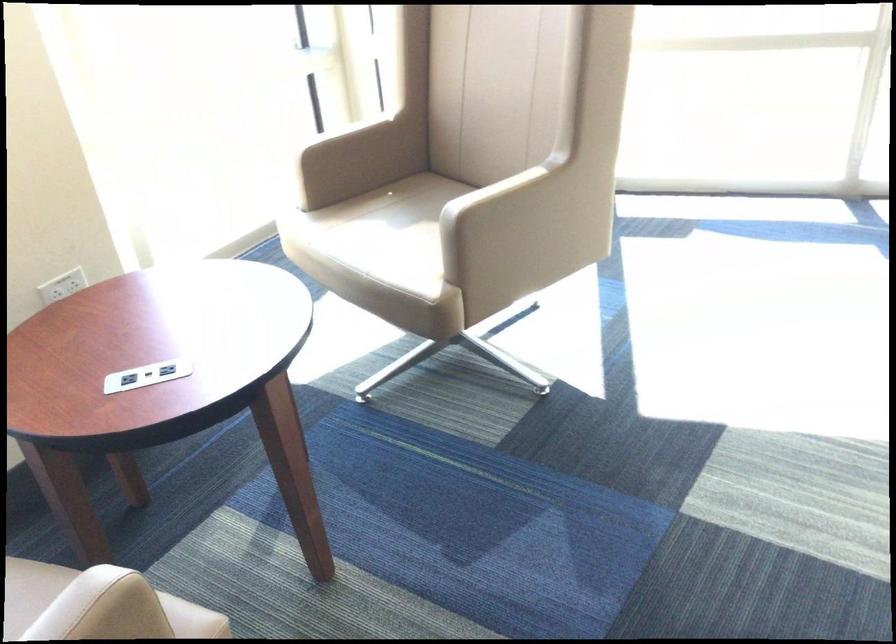
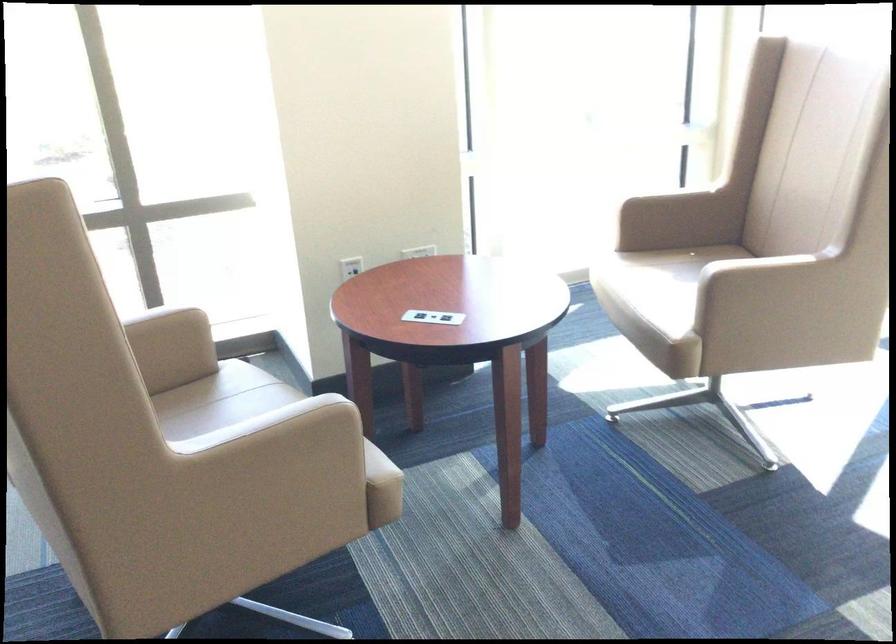
Question: I am providing you with two images of the same scene from different viewpoints. After the viewpoint changes to image2, which objects are now occluded?

Choices:
 (A) chair sitting surface
 (B) black VR controller
 (C) beige chair sitting surface
 (D) beige chair armrest

Answer: (A)